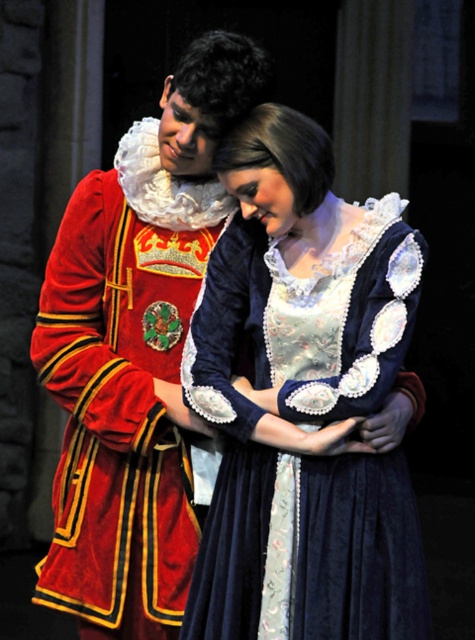
Question: Which of the following is the closest to the observer?

Choices:
 (A) velvet red coat at center
 (B) velvet dress at center

Answer: (B)

Question: Is velvet dress at center below velvet red coat at center?

Choices:
 (A) yes
 (B) no

Answer: (A)

Question: Observing the image, what is the correct spatial positioning of velvet dress at center in reference to velvet red coat at center?

Choices:
 (A) above
 (B) below

Answer: (B)

Question: Which of the following is the closest to the observer?

Choices:
 (A) velvet dress at center
 (B) velvet red coat at center

Answer: (A)

Question: Is velvet dress at center below velvet red coat at center?

Choices:
 (A) no
 (B) yes

Answer: (B)